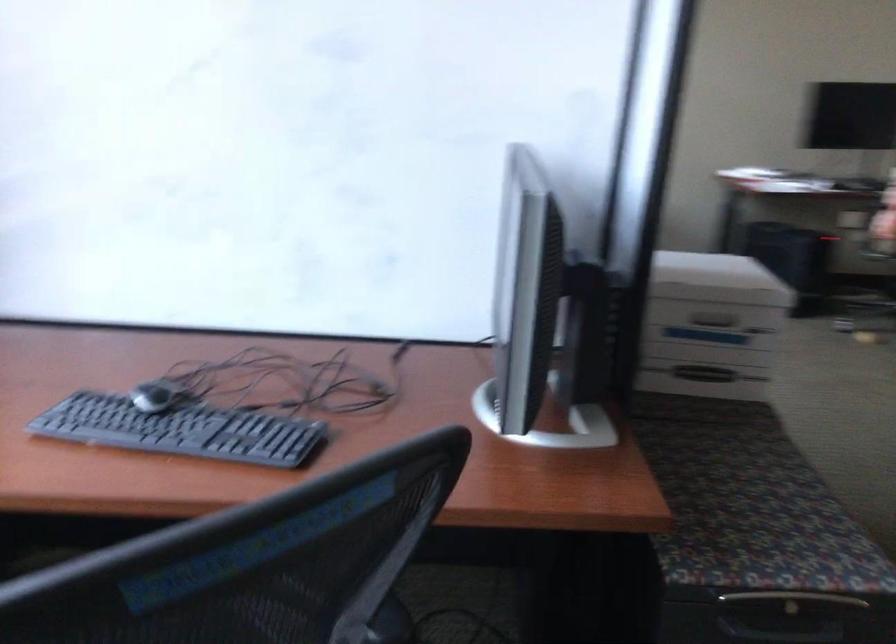
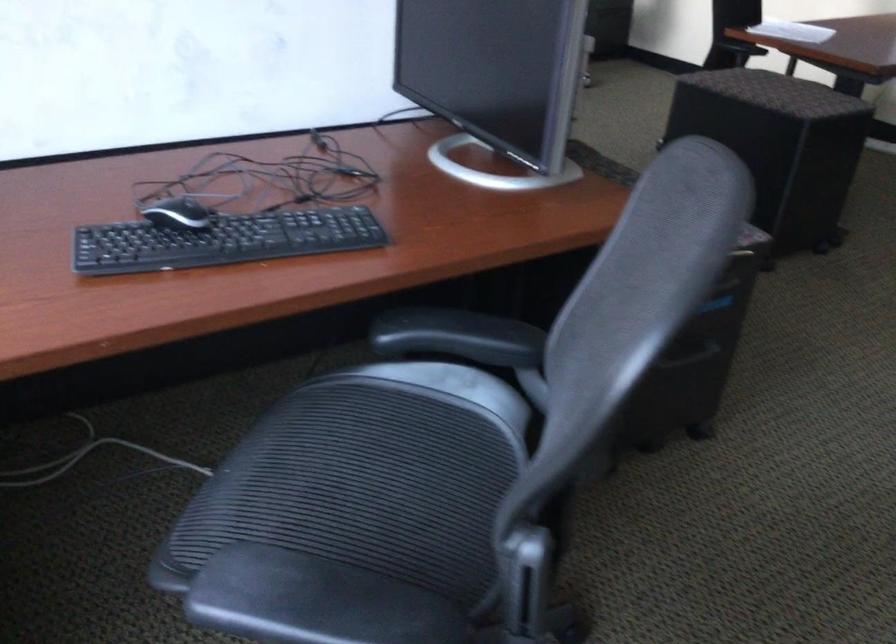
In the second image, find the point that corresponds to [147,392] in the first image.

(177, 214)